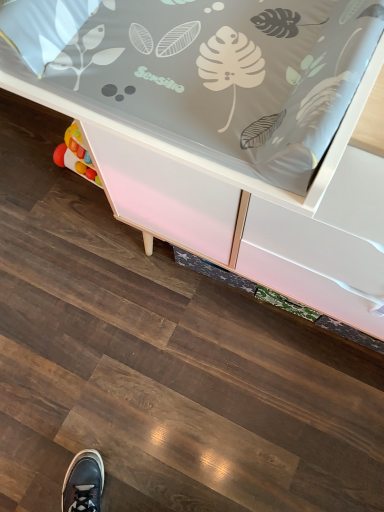
This screenshot has width=384, height=512. Identify the location of matte pink cabinet at center. (232, 133).

What do you see at coordinates (232, 133) in the screenshot?
I see `matte pink cabinet at center` at bounding box center [232, 133].

At what (x,y) coordinates should I click in order to perform the action: click on matte pink cabinet at center. Please return your answer as a coordinate pair (x, y). Looking at the image, I should click on (232, 133).